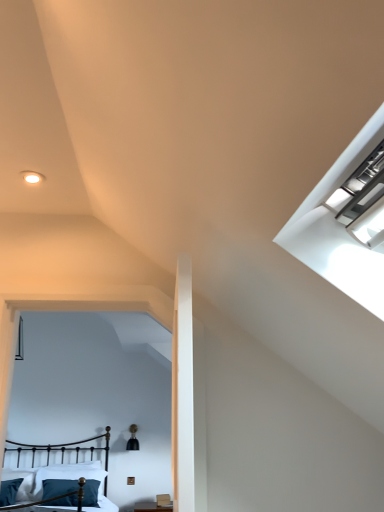
Question: Is black wrought iron bed at lower left in front of or behind teal velvet pillow at lower left, the first pillow viewed from the left, in the image?

Choices:
 (A) behind
 (B) front

Answer: (B)

Question: Is point (56, 487) closer or farther from the camera than point (11, 497)?

Choices:
 (A) closer
 (B) farther

Answer: (B)

Question: Which is nearer to the teal velvet pillow at lower left, the second pillow viewed from the right?

Choices:
 (A) teal fabric pillow at lower left, which is the 1th pillow in right-to-left order
 (B) black wrought iron bed at lower left

Answer: (A)

Question: Which is nearer to the black wrought iron bed at lower left?

Choices:
 (A) teal fabric pillow at lower left, which is the 1th pillow in right-to-left order
 (B) teal velvet pillow at lower left, the second pillow viewed from the right

Answer: (A)